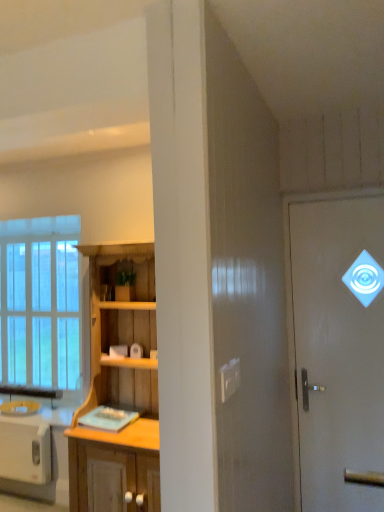
Question: Is wooden cabinet at center completely or partially inside clear glass window at left?

Choices:
 (A) yes
 (B) no

Answer: (B)

Question: Is clear glass window at left taller than wooden cabinet at center?

Choices:
 (A) no
 (B) yes

Answer: (A)

Question: Considering the relative positions of clear glass window at left and wooden cabinet at center in the image provided, is clear glass window at left to the right of wooden cabinet at center from the viewer's perspective?

Choices:
 (A) yes
 (B) no

Answer: (B)

Question: Is clear glass window at left in front of wooden cabinet at center?

Choices:
 (A) no
 (B) yes

Answer: (A)

Question: Is clear glass window at left wider than wooden cabinet at center?

Choices:
 (A) no
 (B) yes

Answer: (A)

Question: From the image's perspective, is wooden cabinet at center located above or below white glossy toaster at lower left?

Choices:
 (A) above
 (B) below

Answer: (A)

Question: From a real-world perspective, is wooden cabinet at center physically located above or below white glossy toaster at lower left?

Choices:
 (A) above
 (B) below

Answer: (A)

Question: Based on their sizes in the image, would you say wooden cabinet at center is bigger or smaller than white glossy toaster at lower left?

Choices:
 (A) big
 (B) small

Answer: (A)

Question: Is wooden cabinet at center in front of or behind white glossy toaster at lower left in the image?

Choices:
 (A) behind
 (B) front

Answer: (B)

Question: Is clear glass window at left bigger or smaller than white glossy toaster at lower left?

Choices:
 (A) small
 (B) big

Answer: (B)

Question: Based on their positions, is clear glass window at left located to the left or right of white glossy toaster at lower left?

Choices:
 (A) right
 (B) left

Answer: (B)

Question: Choose the correct answer: Is clear glass window at left inside white glossy toaster at lower left or outside it?

Choices:
 (A) inside
 (B) outside

Answer: (B)

Question: In the image, is clear glass window at left positioned in front of or behind white glossy toaster at lower left?

Choices:
 (A) front
 (B) behind

Answer: (B)

Question: Based on their positions, is white glossy door at upper right located to the left or right of wooden cabinet at center?

Choices:
 (A) right
 (B) left

Answer: (A)

Question: Relative to wooden cabinet at center, is white glossy door at upper right in front or behind?

Choices:
 (A) front
 (B) behind

Answer: (B)